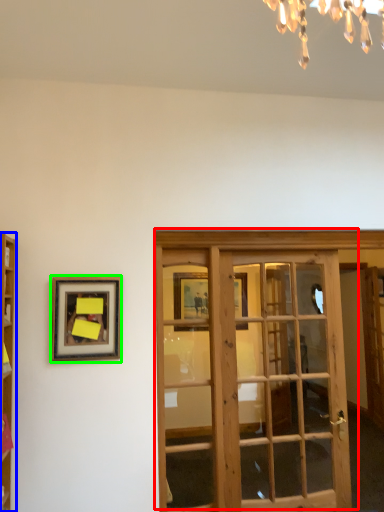
Question: Which object is the closest to the door (highlighted by a red box)? Choose among these: cabinetry (highlighted by a blue box) or picture frame (highlighted by a green box).

Choices:
 (A) cabinetry
 (B) picture frame

Answer: (B)